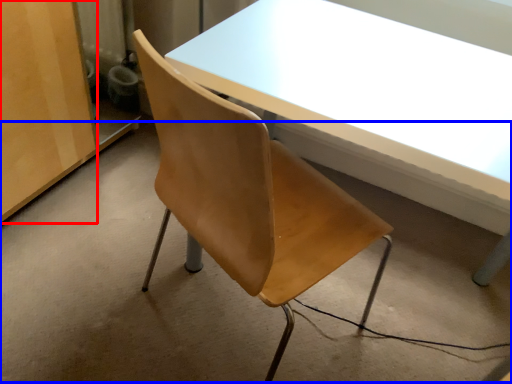
Question: Which object is closer to the camera taking this photo, plywood (highlighted by a red box) or concrete (highlighted by a blue box)?

Choices:
 (A) plywood
 (B) concrete

Answer: (B)